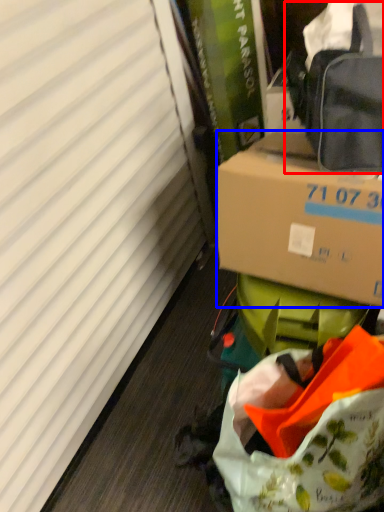
Question: Which of the following is the closest to the observer, pack (highlighted by a red box) or box (highlighted by a blue box)?

Choices:
 (A) pack
 (B) box

Answer: (A)